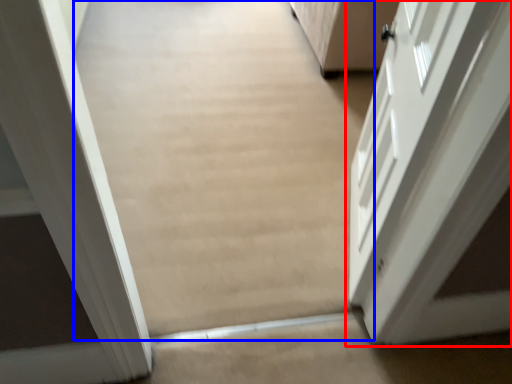
Question: Which object is closer to the camera taking this photo, door (highlighted by a red box) or plain (highlighted by a blue box)?

Choices:
 (A) door
 (B) plain

Answer: (B)